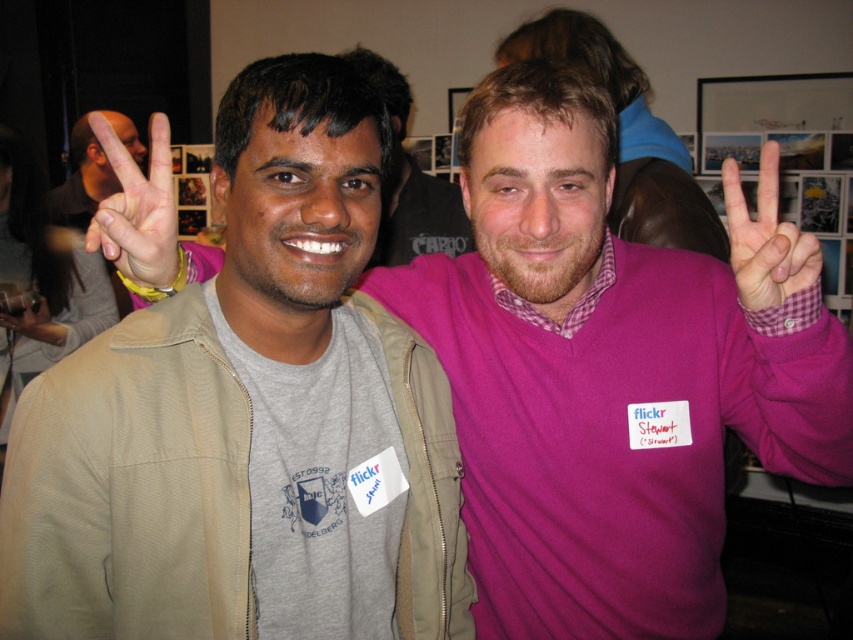
Question: Which object is closer to the camera taking this photo?

Choices:
 (A) matte gray sweatshirt at left
 (B) pink matte sweater at center

Answer: (A)

Question: Can you confirm if matte gray sweatshirt at left is wider than matte black hand at center?

Choices:
 (A) no
 (B) yes

Answer: (B)

Question: Does matte gray sweatshirt at left come in front of pink fabric hand at right?

Choices:
 (A) no
 (B) yes

Answer: (A)

Question: Which point is farther from the camera taking this photo?

Choices:
 (A) (242, 547)
 (B) (44, 308)

Answer: (B)

Question: Which of the following is the closest to the observer?

Choices:
 (A) matte black hand at upper left
 (B) matte skin hand at center
 (C) matte gray sweatshirt at left

Answer: (C)

Question: Is matte gray sweatshirt at left closer to the viewer compared to pink matte sweater at center?

Choices:
 (A) no
 (B) yes

Answer: (B)